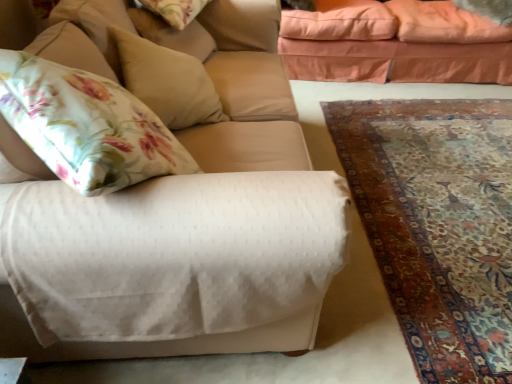
Question: Can you confirm if carpet with intricate patterns at lower right is positioned to the left of white textured fabric couch at center, which is the 1th studio couch from front to back?

Choices:
 (A) yes
 (B) no

Answer: (B)

Question: From the image's perspective, would you say carpet with intricate patterns at lower right is positioned over white textured fabric couch at center, which is the 1th studio couch from front to back?

Choices:
 (A) yes
 (B) no

Answer: (B)

Question: Can you see carpet with intricate patterns at lower right touching white textured fabric couch at center, acting as the second studio couch starting from the right?

Choices:
 (A) yes
 (B) no

Answer: (B)

Question: Is carpet with intricate patterns at lower right positioned beyond the bounds of white textured fabric couch at center, the 2th studio couch from the back?

Choices:
 (A) yes
 (B) no

Answer: (A)

Question: Can you confirm if carpet with intricate patterns at lower right is wider than white textured fabric couch at center, placed as the first studio couch when sorted from left to right?

Choices:
 (A) yes
 (B) no

Answer: (A)

Question: Looking at the image, does white textured fabric couch at center, placed as the first studio couch when sorted from left to right, seem bigger or smaller compared to carpet with intricate patterns at lower right?

Choices:
 (A) small
 (B) big

Answer: (B)

Question: Relative to carpet with intricate patterns at lower right, is white textured fabric couch at center, placed as the first studio couch when sorted from left to right, in front or behind?

Choices:
 (A) behind
 (B) front

Answer: (B)

Question: From a real-world perspective, is white textured fabric couch at center, the 2th studio couch from the back, above or below carpet with intricate patterns at lower right?

Choices:
 (A) above
 (B) below

Answer: (A)

Question: In terms of height, does white textured fabric couch at center, which is the 1th studio couch from front to back, look taller or shorter compared to carpet with intricate patterns at lower right?

Choices:
 (A) short
 (B) tall

Answer: (B)

Question: Is point (75, 31) positioned closer to the camera than point (474, 8)?

Choices:
 (A) farther
 (B) closer

Answer: (B)

Question: Considering the positions of white textured fabric couch at center, placed as the first studio couch when sorted from left to right, and fluffy beige pillow at upper right, positioned as the 3th pillow in bottom-to-top order, in the image, is white textured fabric couch at center, placed as the first studio couch when sorted from left to right, wider or thinner than fluffy beige pillow at upper right, positioned as the 3th pillow in bottom-to-top order,?

Choices:
 (A) wide
 (B) thin

Answer: (A)

Question: From the image's perspective, relative to fluffy beige pillow at upper right, the first pillow viewed from the top, is white textured fabric couch at center, acting as the second studio couch starting from the right, above or below?

Choices:
 (A) above
 (B) below

Answer: (B)

Question: Is white textured fabric couch at center, the 2th studio couch from the back, to the left or to the right of fluffy beige pillow at upper right, which appears as the 3th pillow when viewed from the front, in the image?

Choices:
 (A) right
 (B) left

Answer: (B)

Question: In the image, is beige fabric pillow at upper left, the third pillow viewed from the back, positioned in front of or behind white textured fabric couch at center, the 2th studio couch from the back?

Choices:
 (A) front
 (B) behind

Answer: (B)

Question: In terms of height, does beige fabric pillow at upper left, the 1th pillow in the front-to-back sequence, look taller or shorter compared to white textured fabric couch at center, the 2th studio couch from the back?

Choices:
 (A) short
 (B) tall

Answer: (A)